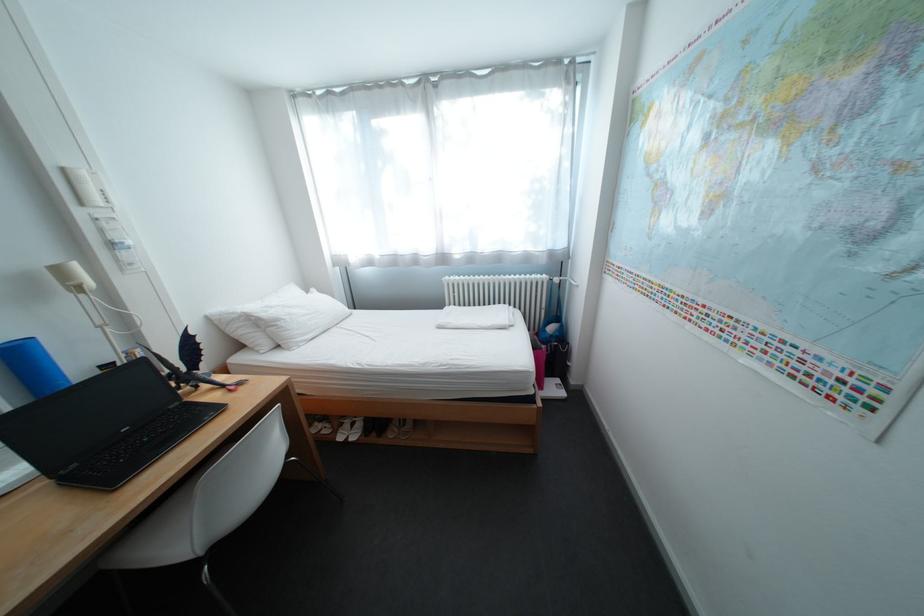
Where is `pair of white sandals`? The height and width of the screenshot is (616, 924). pair of white sandals is located at coordinates (336, 427).